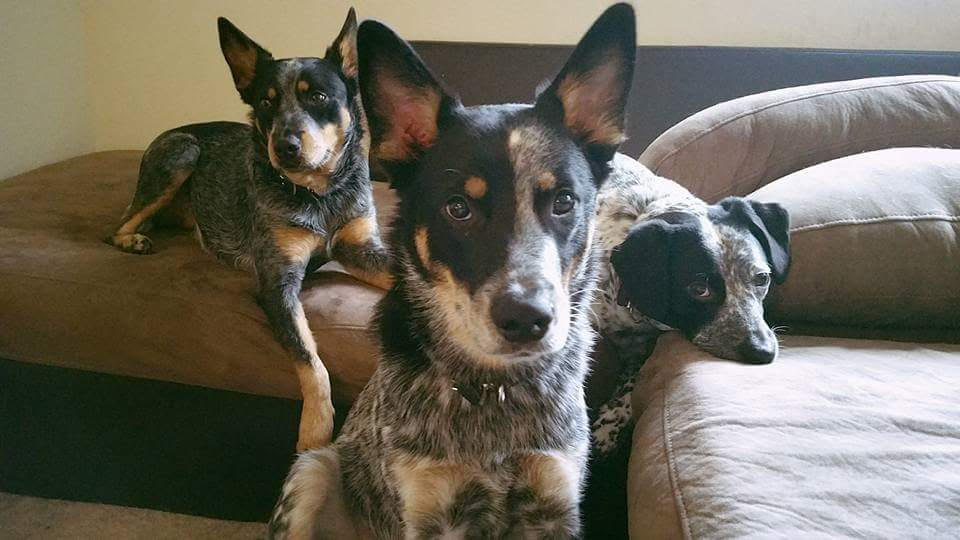
The height and width of the screenshot is (540, 960). I want to click on bright reflection of light on surface of couch cushion, so click(764, 444).